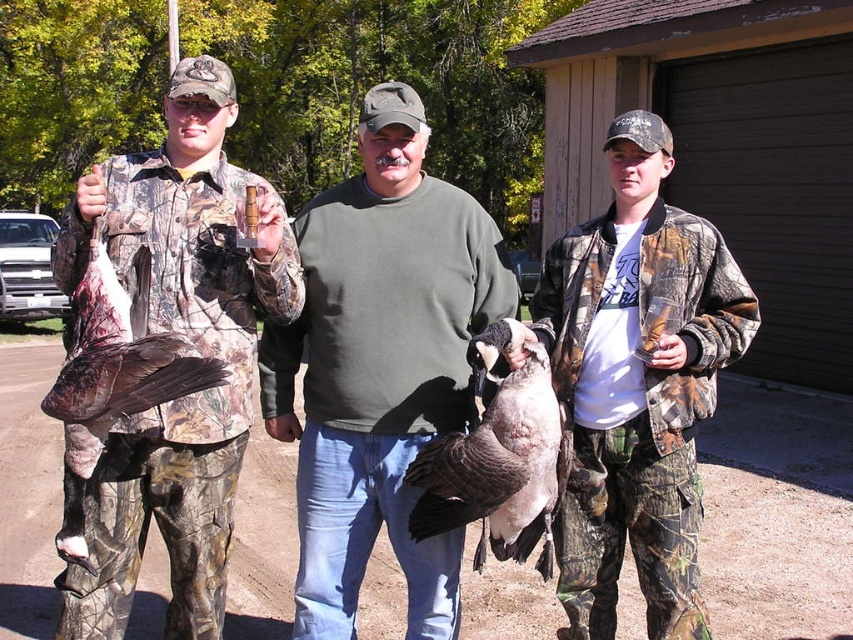
You are a photographer trying to capture a photo of the brown camo duck at left and the camo jacket at center. Which object should you focus on first if you want to include both in your frame without moving the camera?

You should focus on the brown camo duck at left first because it is positioned to the left of the camo jacket at center, so capturing it first ensures both are in frame without needing to adjust the camera position.

You are a photographer standing in front of the scene. You want to take a photo of both the camouflage jacket at left and the brown camo duck at left. Which object should you focus on first to ensure both are in focus?

You should focus on the camouflage jacket at left first because it is closer to you than the brown camo duck at left, ensuring both will be in focus when focused on the closer object.

Based on the photo, you are a photographer trying to capture a clear shot of the brown camo duck at left and the camouflage jacket at left. Which object should you focus on first to ensure it appears in front of the other?

The camouflage jacket at left is positioned over the brown camo duck at left, so you should focus on the camouflage jacket at left first to ensure it appears in front.